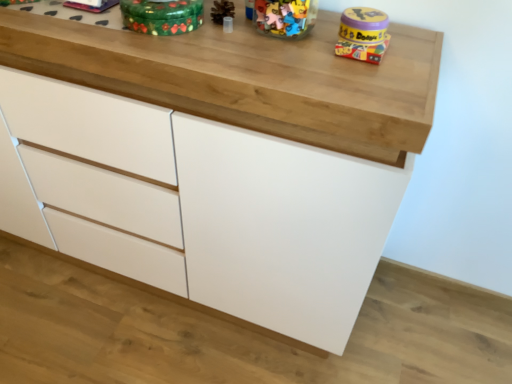
The image size is (512, 384). Identify the location of free location to the left of green painted wood toy at upper center, acting as the 2th toy starting from the right. (72, 26).